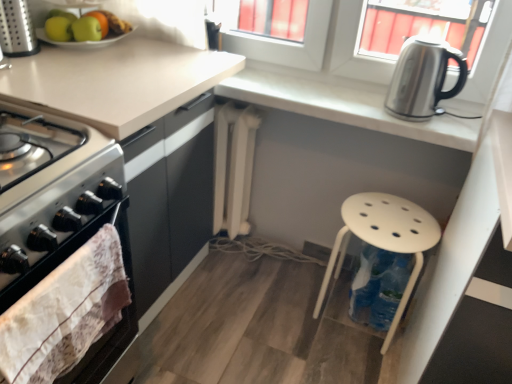
This screenshot has height=384, width=512. What are the coordinates of `free space to the right of green matte apple at upper left, the 1th apple positioned from the right` in the screenshot? It's located at (146, 44).